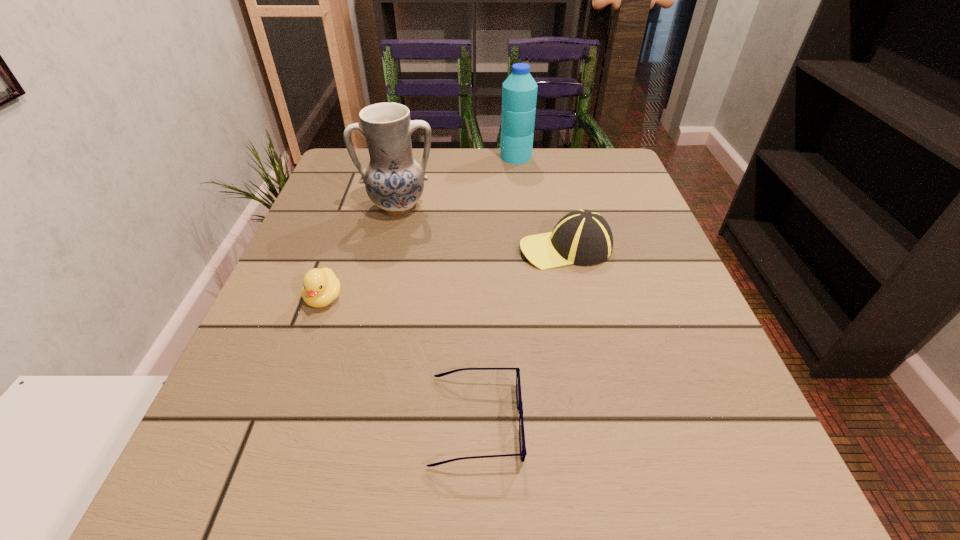
In order to click on vacant space that satisfies the following two spatial constraints: 1. with the brim of the baseball cap facing forward; 2. on the beak of the duckling in this screenshot , I will do `click(577, 298)`.

Identify the location of free space that satisfies the following two spatial constraints: 1. with the brim of the baseball cap facing forward; 2. on the beak of the fourth farthest object. (577, 298).